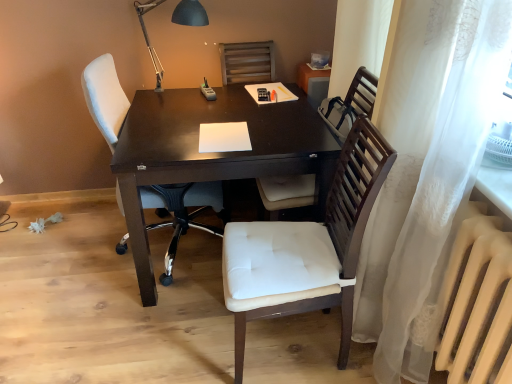
Find the location of a particular element. vacant area situated to the left side of dark wood desk at center is located at coordinates (63, 270).